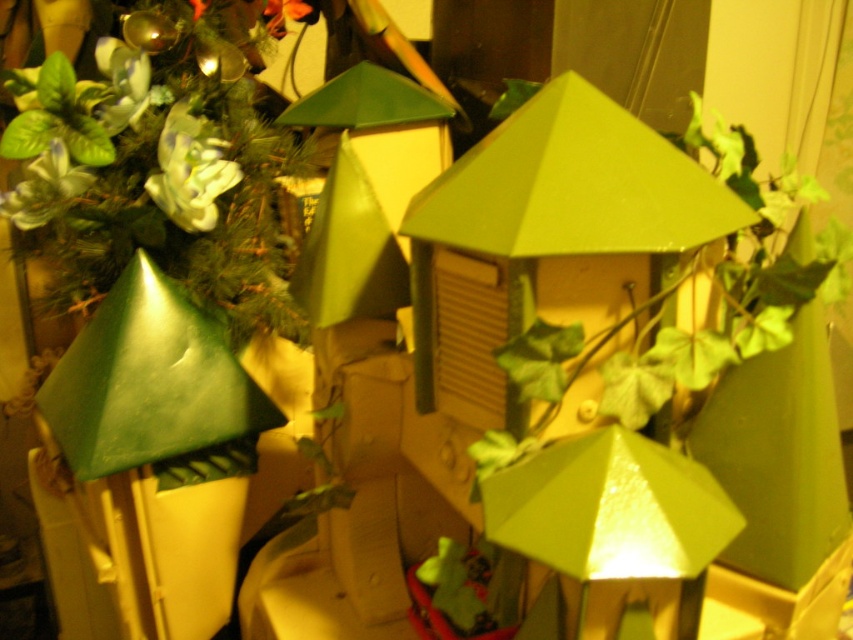
Question: Does green matte plant at left appear under matte green lamp at center?

Choices:
 (A) yes
 (B) no

Answer: (B)

Question: Which object is closer to the camera taking this photo?

Choices:
 (A) matte green lamp at center
 (B) green matte plant at left

Answer: (A)

Question: Which point is farther from the camera taking this photo?

Choices:
 (A) (100, 291)
 (B) (643, 456)

Answer: (A)

Question: Is the position of green matte plant at left less distant than that of matte green lamp at center?

Choices:
 (A) yes
 (B) no

Answer: (B)

Question: Does green matte plant at left have a larger size compared to matte green lamp at center?

Choices:
 (A) no
 (B) yes

Answer: (B)